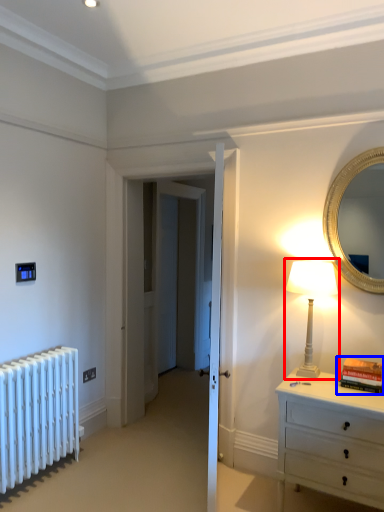
Question: Which point is further to the camera, table lamp (highlighted by a red box) or book (highlighted by a blue box)?

Choices:
 (A) table lamp
 (B) book

Answer: (A)